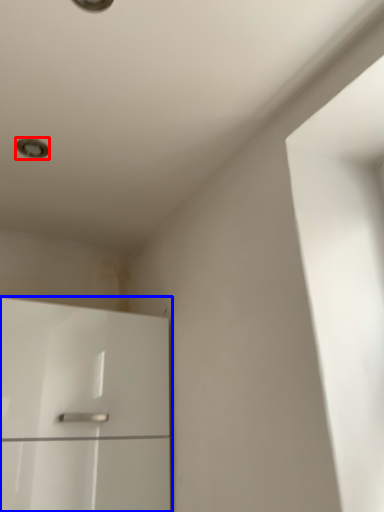
Question: Which object appears farthest to the camera in this image, dot (highlighted by a red box) or cabinetry (highlighted by a blue box)?

Choices:
 (A) dot
 (B) cabinetry

Answer: (A)